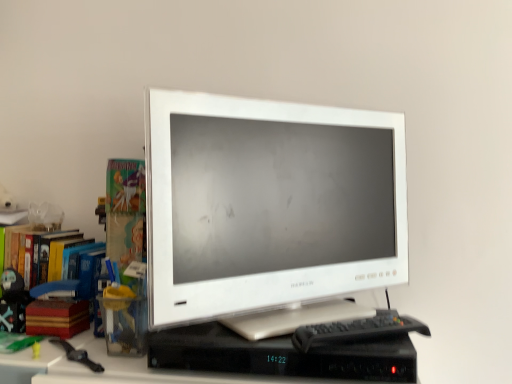
Find the location of `vacant space situated on the left part of black plastic keyboard at center`. vacant space situated on the left part of black plastic keyboard at center is located at coordinates (251, 345).